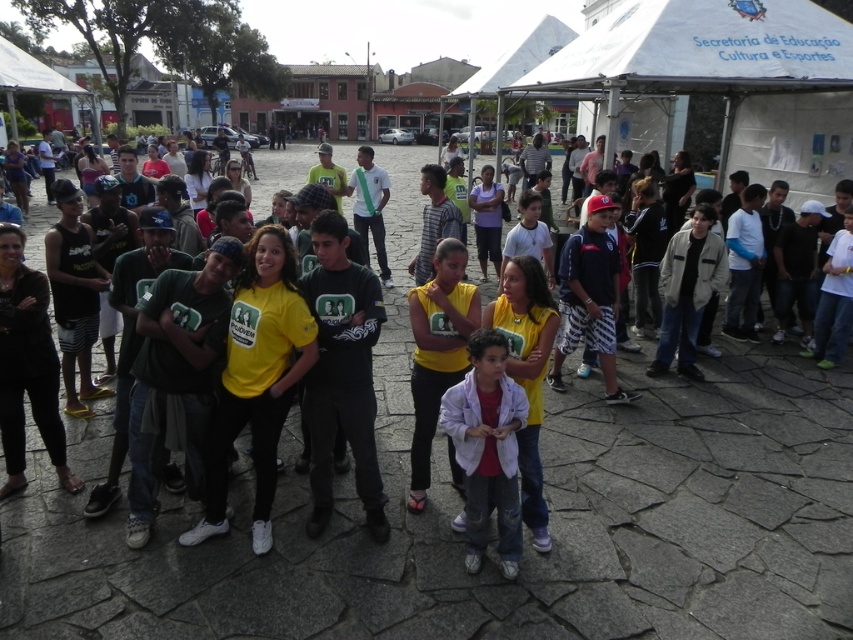
Question: Is white matte jacket at center to the right of dark blue jersey at center from the viewer's perspective?

Choices:
 (A) yes
 (B) no

Answer: (B)

Question: Can you confirm if white matte jacket at center is thinner than dark blue jersey at center?

Choices:
 (A) yes
 (B) no

Answer: (A)

Question: Which object appears closest to the camera in this image?

Choices:
 (A) white matte jacket at center
 (B) dark blue jersey at center

Answer: (A)

Question: Can you confirm if white matte jacket at center is bigger than dark blue jersey at center?

Choices:
 (A) yes
 (B) no

Answer: (B)